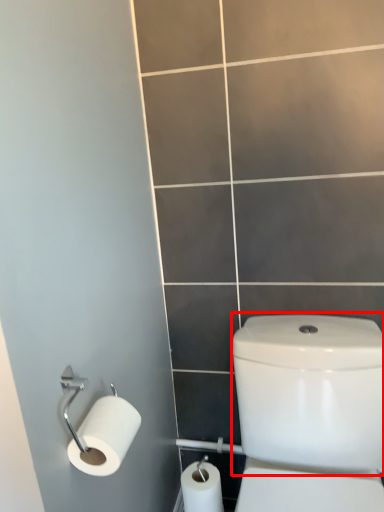
Question: From the image, what is the correct spatial relationship of water tank (annotated by the red box) in relation to toilet paper?

Choices:
 (A) left
 (B) right

Answer: (B)